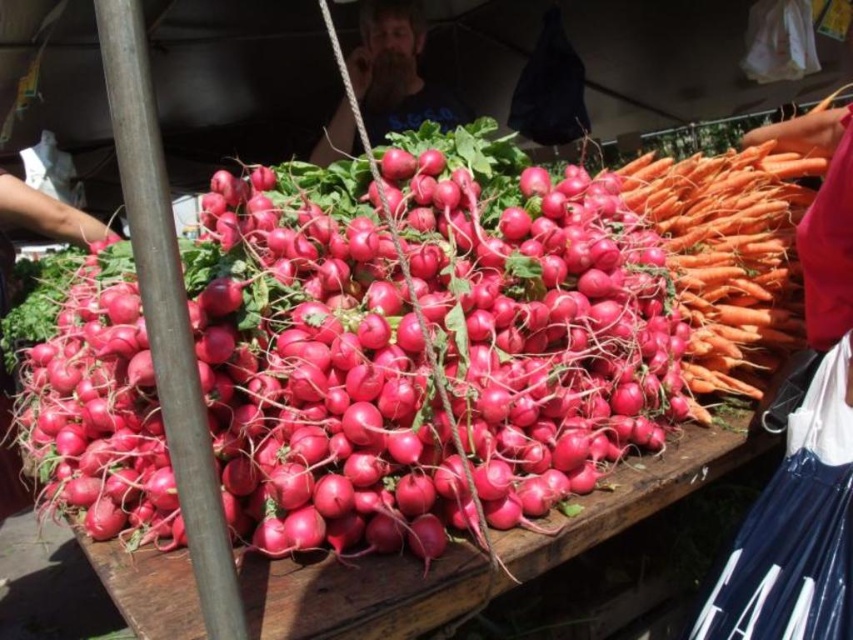
You are a customer at the farmer market and want to buy both the orange smooth carrot at right and the bearded man at center. However, you can only reach one item at a time. Which item is closer to your right hand if you are facing the table?

The orange smooth carrot at right is positioned on the right side of bearded man at center, so the orange smooth carrot at right is closer to your right hand.

In the scene shown: You are a customer at the farmer market and want to buy vegetables. You see the orange smooth carrot at right and the bearded man at center. Which vegetable is wider?

The orange smooth carrot at right might be wider than the bearded man at center.

You are a customer at the farmer market and want to buy both the orange smooth carrot at right and the bearded man at center. However, you can only reach items that are in front of you. Since you are standing in front of the table, can you reach both items?

The orange smooth carrot at right is in front of bearded man at center, so you can reach the orange smooth carrot at right. However, the bearded man at center is behind the carrot, so you cannot reach the bearded man at center.